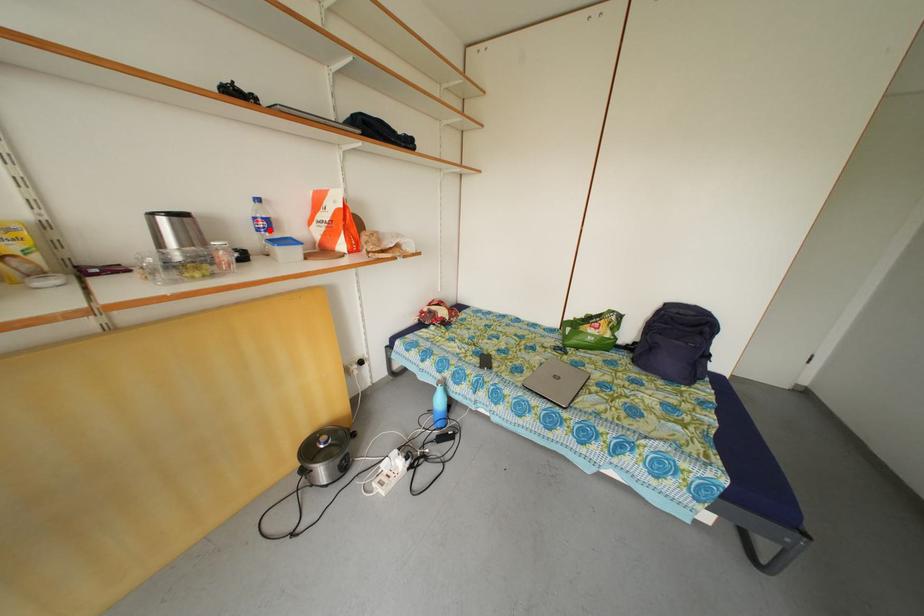
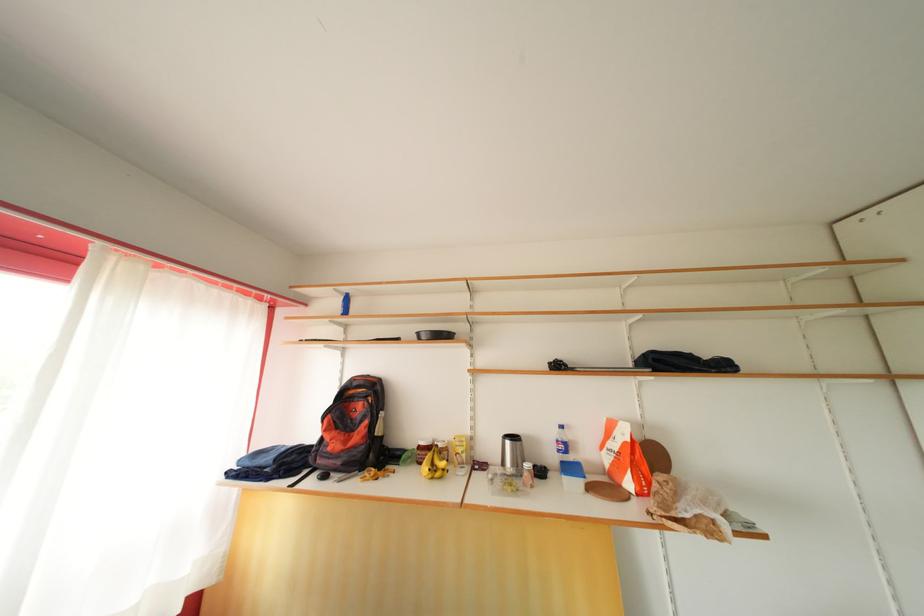
Question: A red point is marked in image1. In image2, is the corresponding 3D point closer to the camera or farther? Reply with the corresponding letter.

Choices:
 (A) The corresponding 3D point is closer.
 (B) The corresponding 3D point is farther.

Answer: (B)